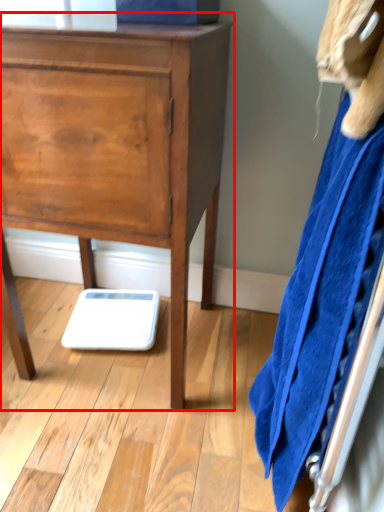
Question: Considering the relative positions of chest of drawers (annotated by the red box) and bath towel in the image provided, where is chest of drawers (annotated by the red box) located with respect to the staircase?

Choices:
 (A) right
 (B) left

Answer: (B)